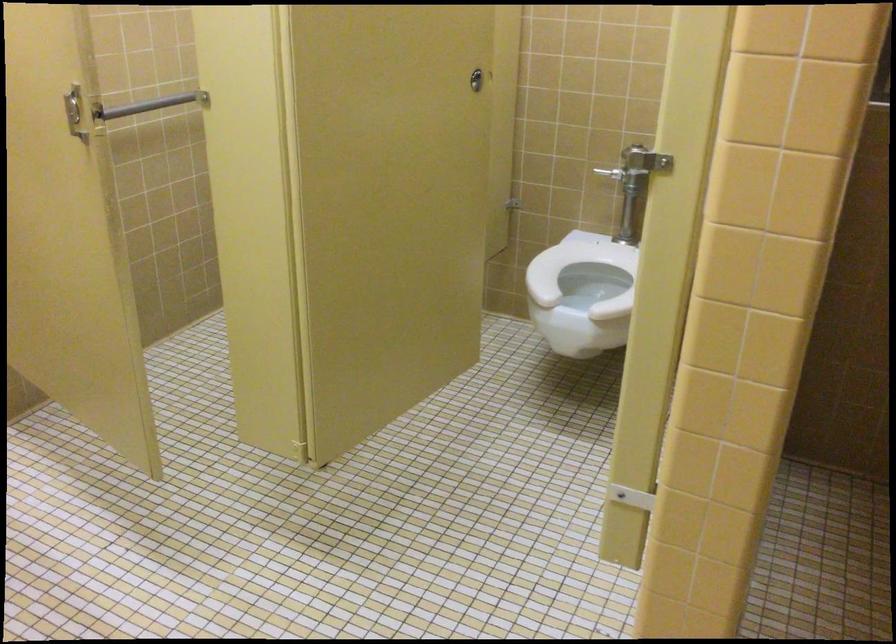
Find where to lift the white toilet seat. Please return your answer as a coordinate pair (x, y).

(578, 268)